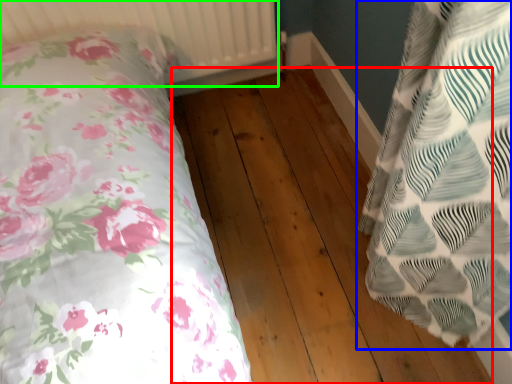
Question: Which object is positioned closest to hardwood (highlighted by a red box)? Select from pillow (highlighted by a blue box) and radiator (highlighted by a green box).

Choices:
 (A) pillow
 (B) radiator

Answer: (A)